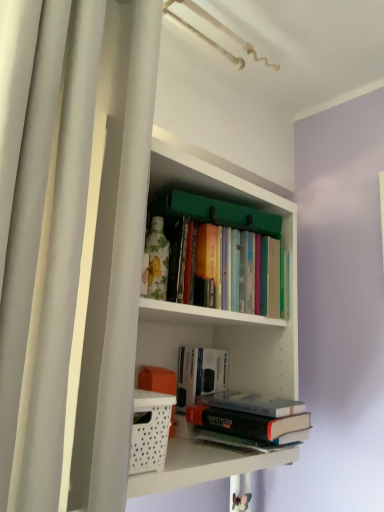
Question: Is white matte shower curtain at left bigger than white matte bookshelf at center?

Choices:
 (A) no
 (B) yes

Answer: (A)

Question: Is white matte shower curtain at left positioned with its back to white matte bookshelf at center?

Choices:
 (A) no
 (B) yes

Answer: (A)

Question: Is white matte shower curtain at left shorter than white matte bookshelf at center?

Choices:
 (A) yes
 (B) no

Answer: (B)

Question: Does white matte shower curtain at left appear on the left side of white matte bookshelf at center?

Choices:
 (A) yes
 (B) no

Answer: (A)

Question: Is the depth of white matte shower curtain at left greater than that of white matte bookshelf at center?

Choices:
 (A) yes
 (B) no

Answer: (B)

Question: Considering the relative sizes of white matte shower curtain at left and white matte bookshelf at center in the image provided, is white matte shower curtain at left taller than white matte bookshelf at center?

Choices:
 (A) yes
 (B) no

Answer: (A)

Question: Is hardcover book at center, the first book ordered from the bottom, facing towards hardcover book at center, the 2th book positioned from the bottom?

Choices:
 (A) no
 (B) yes

Answer: (A)

Question: From the image's perspective, is hardcover book at center, the first book ordered from the bottom, on top of hardcover book at center, the 2th book positioned from the bottom?

Choices:
 (A) no
 (B) yes

Answer: (A)

Question: Does hardcover book at center, the third book when ordered from top to bottom, have a lesser height compared to hardcover book at center, the 2th book positioned from the bottom?

Choices:
 (A) yes
 (B) no

Answer: (A)

Question: From a real-world perspective, is hardcover book at center, the third book when ordered from top to bottom, below hardcover book at center, the 2th book positioned from the bottom?

Choices:
 (A) yes
 (B) no

Answer: (A)

Question: Is hardcover book at center, the third book when ordered from top to bottom, further to camera compared to hardcover book at center, arranged as the second book when viewed from the top?

Choices:
 (A) yes
 (B) no

Answer: (B)

Question: Is hardcover book at center, the first book ordered from the bottom, with hardcover book at center, arranged as the second book when viewed from the top?

Choices:
 (A) no
 (B) yes

Answer: (A)

Question: Is white perforated basket at lower left to the left of white matte bookshelf at center from the viewer's perspective?

Choices:
 (A) yes
 (B) no

Answer: (A)